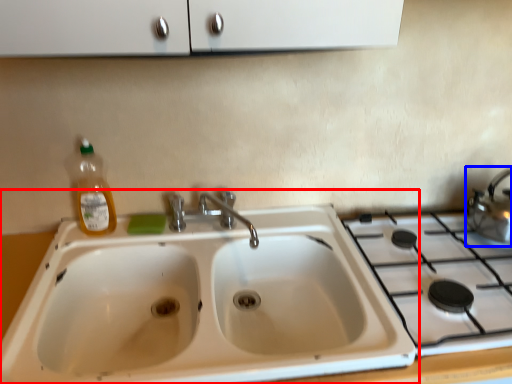
Question: Among these objects, which one is farthest to the camera, sink (highlighted by a red box) or tea pot (highlighted by a blue box)?

Choices:
 (A) sink
 (B) tea pot

Answer: (B)